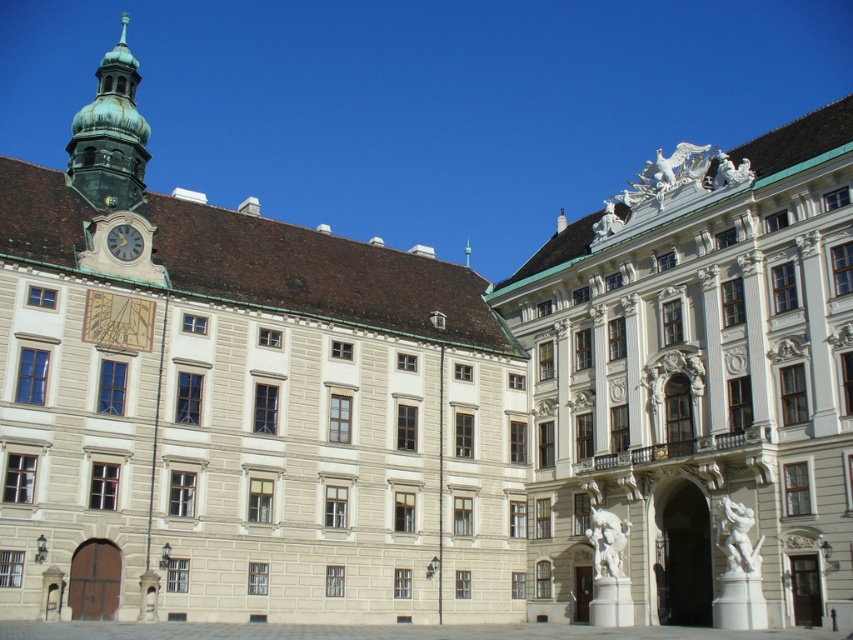
You are standing in front of the grand historic building and want to take a photo of both the beige stone building at center and the green copper bell tower at upper left. Which object should you point your camera towards first to ensure both are in the frame?

You should point your camera towards the green copper bell tower at upper left first because the beige stone building at center is located below it, ensuring both will be captured in the frame.